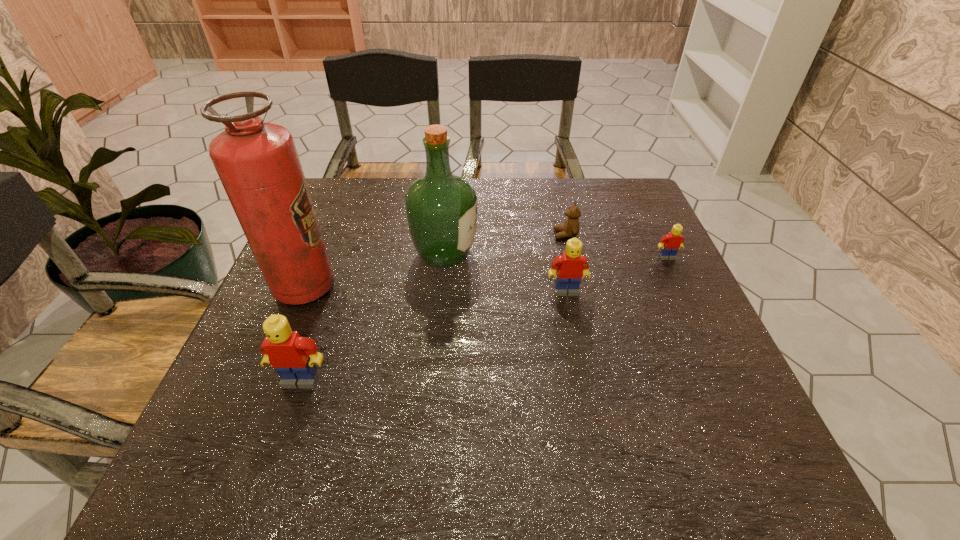
Identify the location of the second closest Lego to the fourth tallest object. (293, 357).

Where is `vacant region that satisfies the following two spatial constraints: 1. on the front-facing side of the liquor; 2. on the front-facing side of the nearest Lego`? This screenshot has width=960, height=540. vacant region that satisfies the following two spatial constraints: 1. on the front-facing side of the liquor; 2. on the front-facing side of the nearest Lego is located at coordinates (433, 380).

I want to click on free region that satisfies the following two spatial constraints: 1. on the front-facing side of the farthest Lego; 2. on the label side of the fire extinguisher, so click(682, 287).